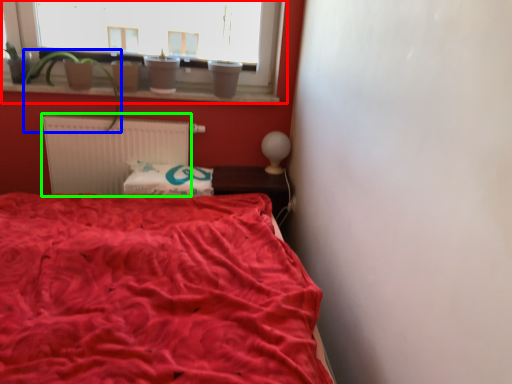
Question: Estimate the real-world distances between objects in this image. Which object is farther from window (highlighted by a red box), plant (highlighted by a blue box) or radiator (highlighted by a green box)?

Choices:
 (A) plant
 (B) radiator

Answer: (B)